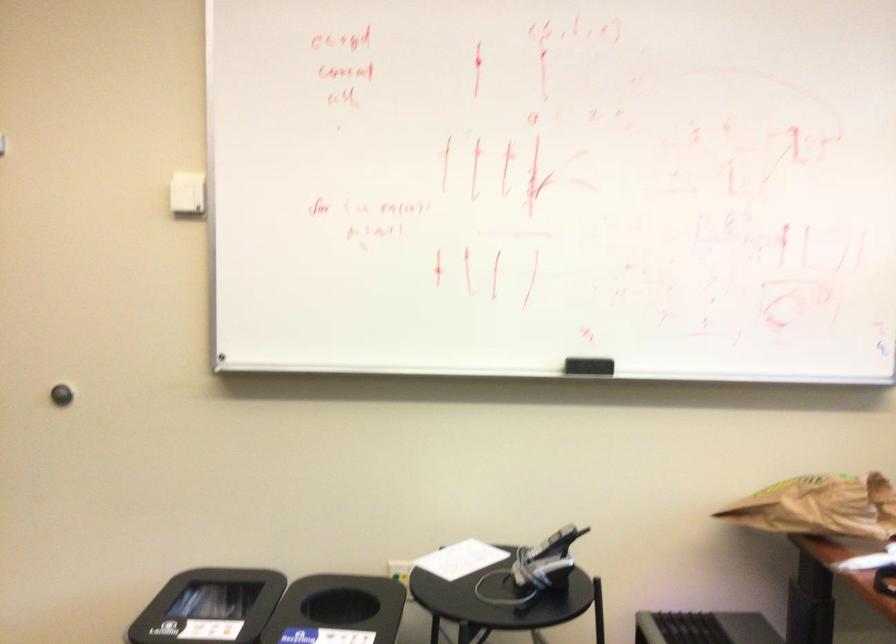
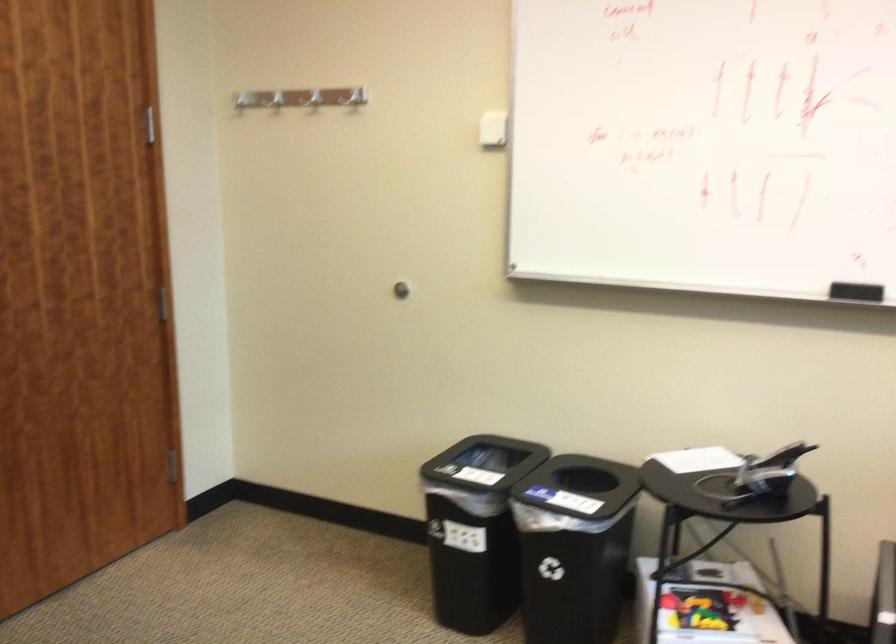
Locate, in the second image, the point that corresponds to [554,544] in the first image.

(782, 456)